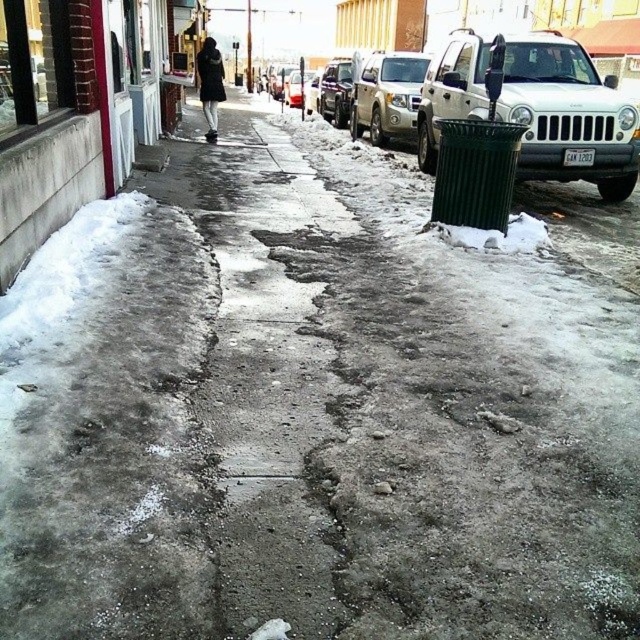
Is satin silver jeep at center further to the viewer compared to metallic silver suv at center?

No, it is not.

Is satin silver jeep at center to the left of metallic silver suv at center from the viewer's perspective?

In fact, satin silver jeep at center is to the right of metallic silver suv at center.

Who is more distant from viewer, (328,67) or (288,80)?

The point (288,80) is more distant.

This screenshot has width=640, height=640. Find the location of `satin silver jeep at center`. satin silver jeep at center is located at coordinates (336, 92).

Is satin silver suv at center taller than satin silver jeep at center?

Yes, satin silver suv at center is taller than satin silver jeep at center.

Image resolution: width=640 pixels, height=640 pixels. Describe the element at coordinates (385, 93) in the screenshot. I see `satin silver suv at center` at that location.

You are a GUI agent. You are given a task and a screenshot of the screen. Output one action in this format:
    pyautogui.click(x=<x>, y=<y>)
    Task: Click on the satin silver suv at center
    Image resolution: width=640 pixels, height=640 pixels.
    Given the screenshot: What is the action you would take?
    pyautogui.click(x=385, y=93)

Does satin silver suv at center have a lesser height compared to metallic silver suv at center?

Yes, satin silver suv at center is shorter than metallic silver suv at center.

Does point (372, 90) come behind point (305, 77)?

No, it is in front of (305, 77).

Where is `satin silver suv at center`? The image size is (640, 640). satin silver suv at center is located at coordinates (385, 93).